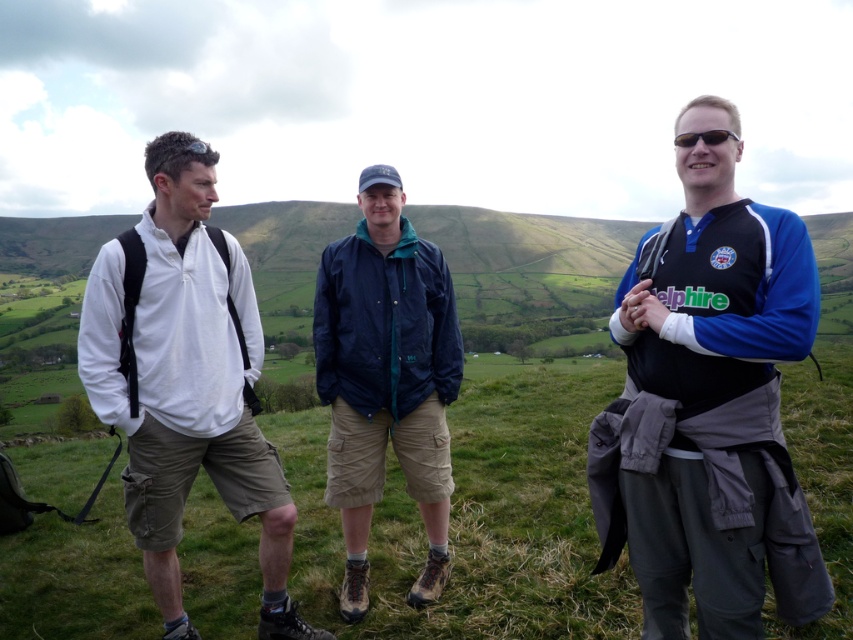
You are a photographer trying to capture a clear shot of the blue jersey at center and the navy blue jacket at center. Which one is closer to the camera based on their positions?

The blue jersey at center is in front of the navy blue jacket at center, so it is closer to the camera.

You are standing in the middle of the grassy hills and see two points marked in the scene. The first point is at coordinates point (792, 346) and the second point is at point (358, 381). Which point is nearer to you?

Point (792, 346) is closer to the camera than point (358, 381), so the first point is nearer to you.